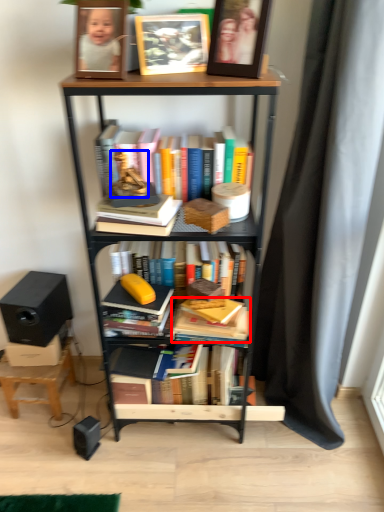
Question: Which of the following is the farthest to the observer, book (highlighted by a red box) or toy (highlighted by a blue box)?

Choices:
 (A) book
 (B) toy

Answer: (A)